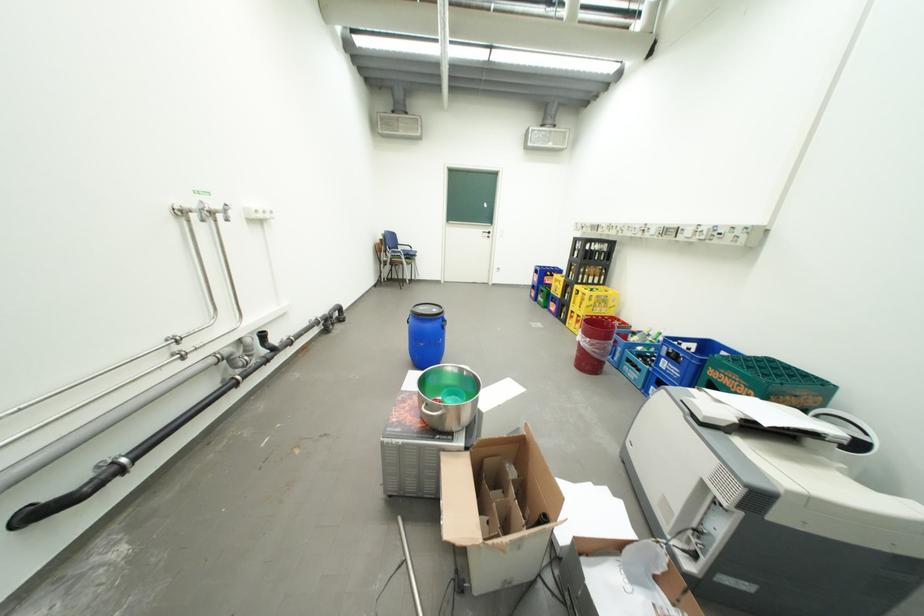
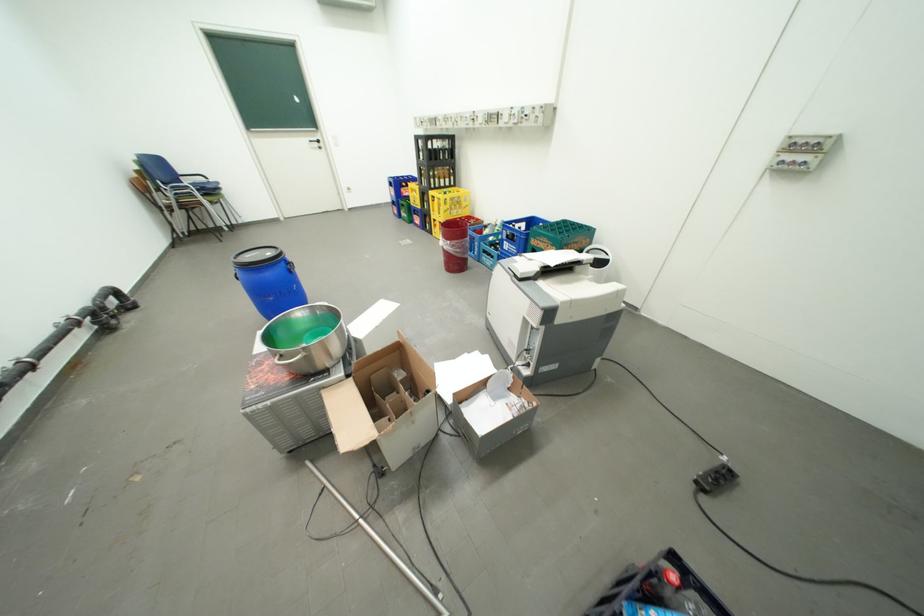
Where in the second image is the point corresponding to point 584,257 from the first image?

(430, 159)